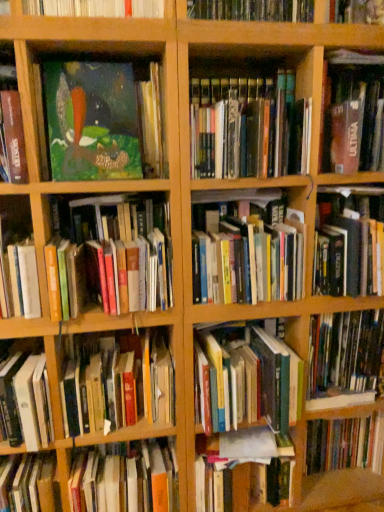
Question: From the image's perspective, is hardcover book at lower left, which ranks as the 12th book in top-to-bottom order, above wooden bookshelf at upper center, placed as the second shelf when sorted from left to right?

Choices:
 (A) yes
 (B) no

Answer: (B)

Question: Could you tell me if hardcover book at lower left, the fourth book when ordered from bottom to top, is facing wooden bookshelf at upper center, marked as the 1th shelf in a right-to-left arrangement?

Choices:
 (A) no
 (B) yes

Answer: (A)

Question: Is hardcover book at lower left, the fourth book when ordered from bottom to top, wider than wooden bookshelf at upper center, placed as the second shelf when sorted from left to right?

Choices:
 (A) no
 (B) yes

Answer: (A)

Question: Is hardcover book at lower left, the fourth book when ordered from bottom to top, shorter than wooden bookshelf at upper center, placed as the second shelf when sorted from left to right?

Choices:
 (A) yes
 (B) no

Answer: (B)

Question: From a real-world perspective, is hardcover book at lower left, which ranks as the 12th book in top-to-bottom order, positioned under wooden bookshelf at upper center, marked as the 1th shelf in a right-to-left arrangement, based on gravity?

Choices:
 (A) no
 (B) yes

Answer: (B)

Question: From the image's perspective, is hardcover book at center, which is the 2th book in bottom-to-top order, located above or below hardcover books at center, the sixth book when ordered from bottom to top?

Choices:
 (A) below
 (B) above

Answer: (A)

Question: Considering the positions of hardcover book at center, the 14th book when ordered from top to bottom, and hardcover books at center, the sixth book when ordered from bottom to top, in the image, is hardcover book at center, the 14th book when ordered from top to bottom, taller or shorter than hardcover books at center, the sixth book when ordered from bottom to top,?

Choices:
 (A) short
 (B) tall

Answer: (B)

Question: Based on their positions, is hardcover book at center, the 14th book when ordered from top to bottom, located to the left or right of hardcover books at center, the sixth book when ordered from bottom to top?

Choices:
 (A) left
 (B) right

Answer: (A)

Question: Looking at their shapes, would you say hardcover book at center, the 14th book when ordered from top to bottom, is wider or thinner than hardcover books at center, which is the 10th book from top to bottom?

Choices:
 (A) wide
 (B) thin

Answer: (B)

Question: Is point (231, 407) positioned closer to the camera than point (19, 179)?

Choices:
 (A) closer
 (B) farther

Answer: (B)

Question: In terms of width, does hardcover books at center, the sixth book when ordered from bottom to top, look wider or thinner when compared to matte green painting at upper left, the 3th book when ordered from top to bottom?

Choices:
 (A) thin
 (B) wide

Answer: (B)

Question: In terms of height, does hardcover books at center, which is the 10th book from top to bottom, look taller or shorter compared to matte green painting at upper left, the 3th book when ordered from top to bottom?

Choices:
 (A) short
 (B) tall

Answer: (A)

Question: Choose the correct answer: Is hardcover books at center, which is the 10th book from top to bottom, inside matte green painting at upper left, the 13th book from the bottom, or outside it?

Choices:
 (A) outside
 (B) inside

Answer: (A)

Question: From their relative heights in the image, would you say hardcover book at center, arranged as the fifteenth book when viewed from the top, is taller or shorter than hardcover book at left, acting as the eighth book starting from the top?

Choices:
 (A) tall
 (B) short

Answer: (B)

Question: Is point (281, 485) positioned closer to the camera than point (39, 311)?

Choices:
 (A) farther
 (B) closer

Answer: (A)